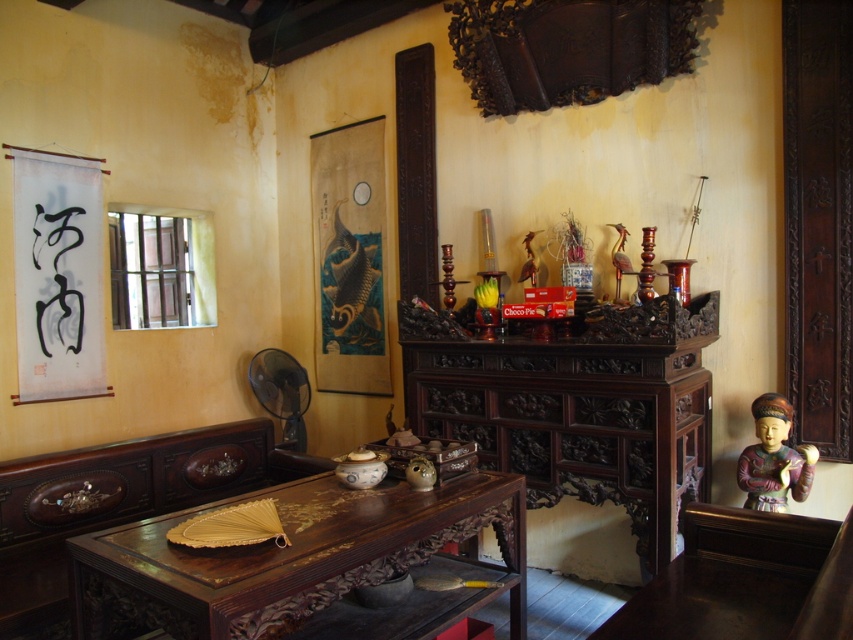
Question: Is wooden polished table at center above wooden statue at right?

Choices:
 (A) no
 (B) yes

Answer: (A)

Question: Does wooden polished table at center have a lesser width compared to wooden statue at right?

Choices:
 (A) no
 (B) yes

Answer: (A)

Question: Is wooden polished table at center to the left of wooden statue at right from the viewer's perspective?

Choices:
 (A) yes
 (B) no

Answer: (A)

Question: Which object is closer to the camera taking this photo?

Choices:
 (A) wooden statue at right
 (B) wooden polished table at center

Answer: (B)